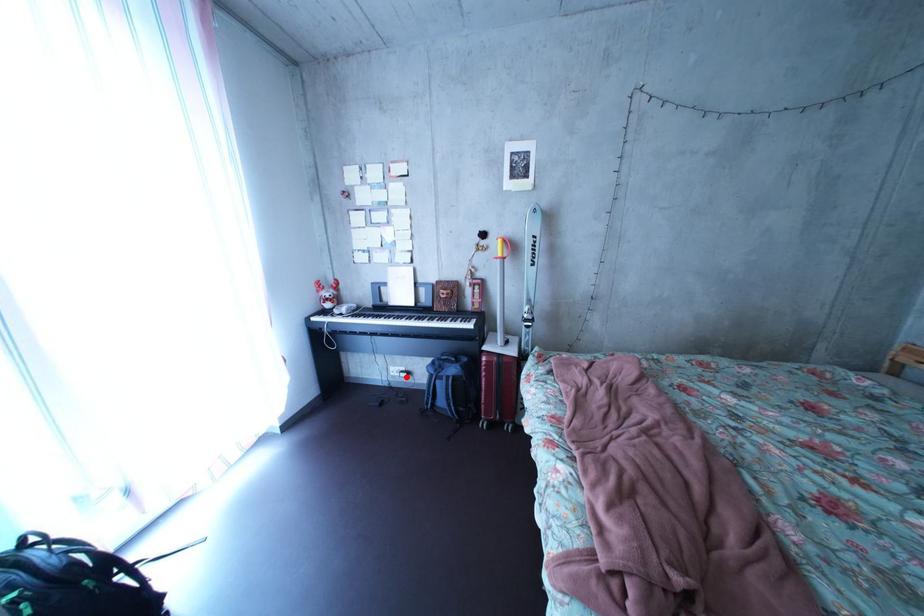
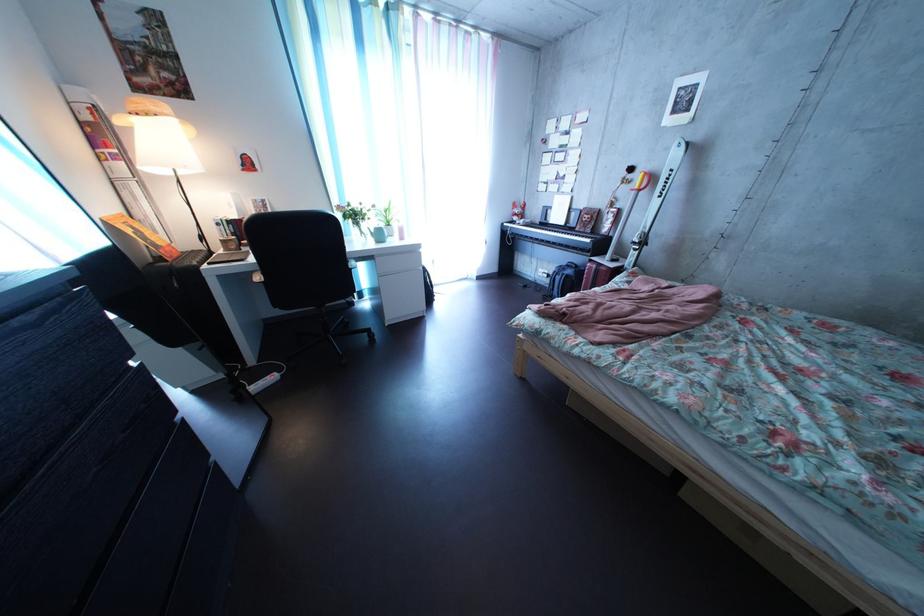
Question: I am providing you with two images of the same scene from different viewpoints. Image1 has a red point marked. In image2, the corresponding 3D location appears at what relative position? Reply with the corresponding letter.

Choices:
 (A) Closer
 (B) Farther

Answer: (A)